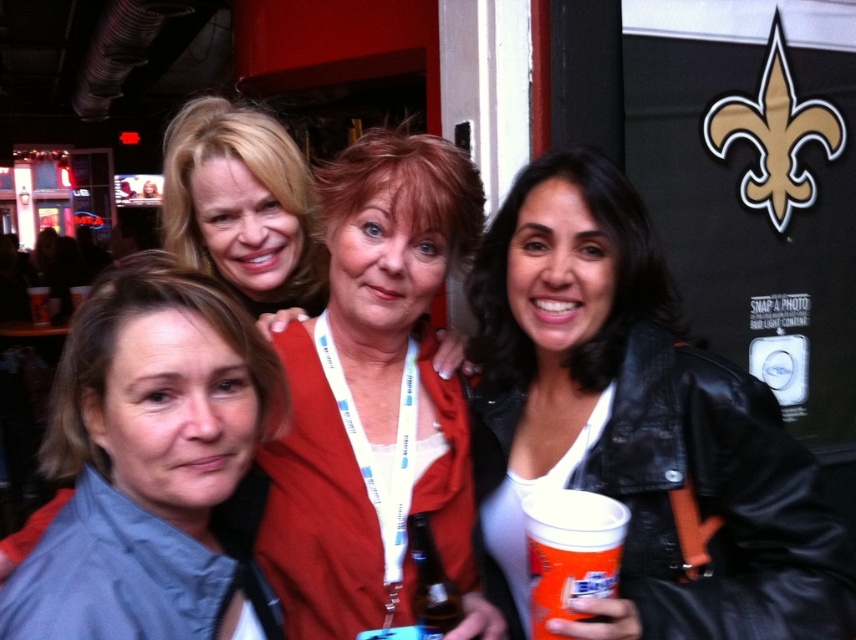
Is black leather jacket at center to the left of matte black jacket at center from the viewer's perspective?

No, black leather jacket at center is not to the left of matte black jacket at center.

Which is more to the left, black leather jacket at center or matte black jacket at center?

matte black jacket at center

The height and width of the screenshot is (640, 856). What are the coordinates of `black leather jacket at center` in the screenshot? It's located at (635, 428).

Between black leather jacket at center and gray fabric jacket at lower left, which one appears on the right side from the viewer's perspective?

From the viewer's perspective, black leather jacket at center appears more on the right side.

Can you confirm if black leather jacket at center is positioned to the left of gray fabric jacket at lower left?

Incorrect, black leather jacket at center is not on the left side of gray fabric jacket at lower left.

At what (x,y) coordinates should I click in order to perform the action: click on black leather jacket at center. Please return your answer as a coordinate pair (x, y). Looking at the image, I should click on (635, 428).

What do you see at coordinates (372, 388) in the screenshot? This screenshot has height=640, width=856. I see `matte black jacket at center` at bounding box center [372, 388].

Can you confirm if matte black jacket at center is thinner than gray fabric jacket at lower left?

No, matte black jacket at center is not thinner than gray fabric jacket at lower left.

Who is more forward, (352,424) or (92,465)?

Point (92,465) is in front.

The height and width of the screenshot is (640, 856). I want to click on matte black jacket at center, so click(372, 388).